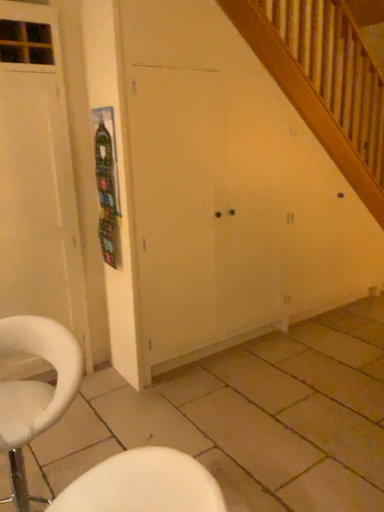
Question: Is metallic silver poster at upper left closer to camera compared to white wood door at left?

Choices:
 (A) yes
 (B) no

Answer: (B)

Question: Is metallic silver poster at upper left at the left side of white wood door at left?

Choices:
 (A) no
 (B) yes

Answer: (A)

Question: Does metallic silver poster at upper left appear on the right side of white wood door at left?

Choices:
 (A) yes
 (B) no

Answer: (A)

Question: From the image's perspective, would you say metallic silver poster at upper left is positioned over white wood door at left?

Choices:
 (A) no
 (B) yes

Answer: (B)

Question: Is metallic silver poster at upper left shorter than white wood door at left?

Choices:
 (A) yes
 (B) no

Answer: (A)

Question: Could you tell me if metallic silver poster at upper left is facing white wood door at left?

Choices:
 (A) no
 (B) yes

Answer: (A)

Question: Is beige tile at lower center positioned beyond the bounds of white wood door at left?

Choices:
 (A) no
 (B) yes

Answer: (B)

Question: Does beige tile at lower center have a greater height compared to white wood door at left?

Choices:
 (A) no
 (B) yes

Answer: (A)

Question: Considering the relative sizes of beige tile at lower center and white wood door at left in the image provided, is beige tile at lower center thinner than white wood door at left?

Choices:
 (A) no
 (B) yes

Answer: (A)

Question: Does beige tile at lower center turn towards white wood door at left?

Choices:
 (A) yes
 (B) no

Answer: (B)

Question: Does beige tile at lower center have a larger size compared to white wood door at left?

Choices:
 (A) no
 (B) yes

Answer: (A)

Question: Is beige tile at lower center oriented away from white wood door at left?

Choices:
 (A) yes
 (B) no

Answer: (B)

Question: Can you confirm if beige tile at lower center is positioned to the left of white matte cabinet at center?

Choices:
 (A) no
 (B) yes

Answer: (A)